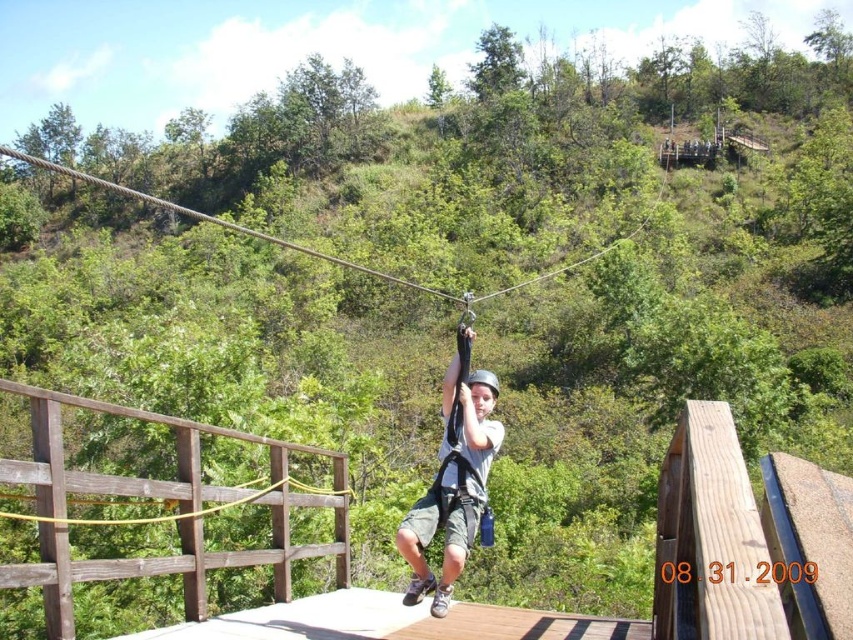
Can you confirm if matte black harness at center is positioned to the left of yellow rubber rope at center?

Incorrect, matte black harness at center is not on the left side of yellow rubber rope at center.

Is point (469, 525) less distant than point (230, 504)?

That is True.

Is point (451, 580) positioned behind point (26, 515)?

No, (451, 580) is in front of (26, 515).

Locate an element on the screen. The width and height of the screenshot is (853, 640). matte black harness at center is located at coordinates (454, 480).

Is brown rope at upper center taller than yellow rubber rope at center?

Yes.

Which of these two, brown rope at upper center or yellow rubber rope at center, stands taller?

Standing taller between the two is brown rope at upper center.

At what (x,y) coordinates should I click in order to perform the action: click on brown rope at upper center. Please return your answer as a coordinate pair (x, y). This screenshot has width=853, height=640. Looking at the image, I should click on (216, 220).

Identify the location of brown rope at upper center. This screenshot has height=640, width=853. (216, 220).

Is matte black harness at center to the right of brown rope at upper center from the viewer's perspective?

Indeed, matte black harness at center is positioned on the right side of brown rope at upper center.

Locate an element on the screen. Image resolution: width=853 pixels, height=640 pixels. matte black harness at center is located at coordinates (454, 480).

The image size is (853, 640). I want to click on matte black harness at center, so click(454, 480).

Where is `matte black harness at center`? The width and height of the screenshot is (853, 640). matte black harness at center is located at coordinates (454, 480).